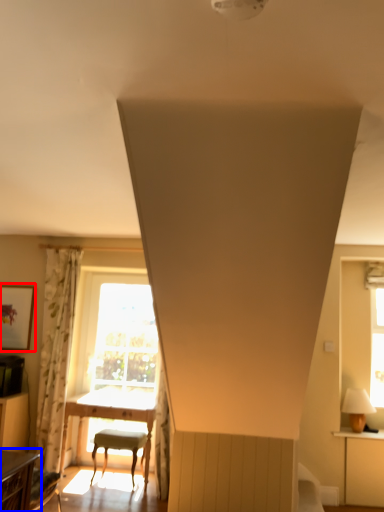
Question: Which object is closer to the camera taking this photo, picture frame (highlighted by a red box) or table (highlighted by a blue box)?

Choices:
 (A) picture frame
 (B) table

Answer: (B)